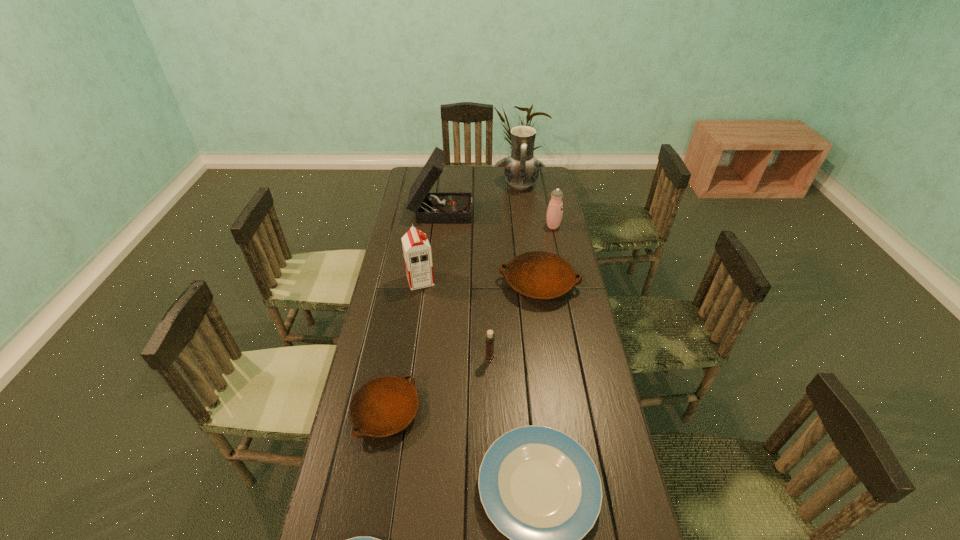
At what (x,y) coordinates should I click in order to perform the action: click on vacant position located on the front-facing side of the phonograph_record. Please return your answer as a coordinate pair (x, y). The width and height of the screenshot is (960, 540). Looking at the image, I should click on (529, 210).

At what (x,y) coordinates should I click in order to perform the action: click on free space located 0.160m on the front-facing side of the farthest object. Please return your answer as a coordinate pair (x, y). Image resolution: width=960 pixels, height=540 pixels. Looking at the image, I should click on (472, 185).

The image size is (960, 540). Identify the location of free space located on the front-facing side of the farthest object. 470,185.

This screenshot has height=540, width=960. I want to click on free location located on the front-facing side of the farthest object, so click(444, 185).

Identify the location of vacant space located 0.300m on the back of the soya milk. (428, 227).

Where is `free region located 0.050m on the left of the fourth tallest object`? The height and width of the screenshot is (540, 960). free region located 0.050m on the left of the fourth tallest object is located at coordinates (535, 227).

The width and height of the screenshot is (960, 540). In order to click on vacant space situated 0.120m on the back of the sixth farthest object in this screenshot , I will do `click(489, 327)`.

Locate an element on the screen. Image resolution: width=960 pixels, height=540 pixels. vacant region located on the front of the fourth shortest object is located at coordinates (552, 375).

You are a GUI agent. You are given a task and a screenshot of the screen. Output one action in this format:
    pyautogui.click(x=<x>, y=<y>)
    Task: Click on the free space located on the right of the nearer brown plate
    The width and height of the screenshot is (960, 540).
    Given the screenshot: What is the action you would take?
    pyautogui.click(x=494, y=413)

This screenshot has width=960, height=540. I want to click on object that is at the far edge, so click(x=521, y=170).